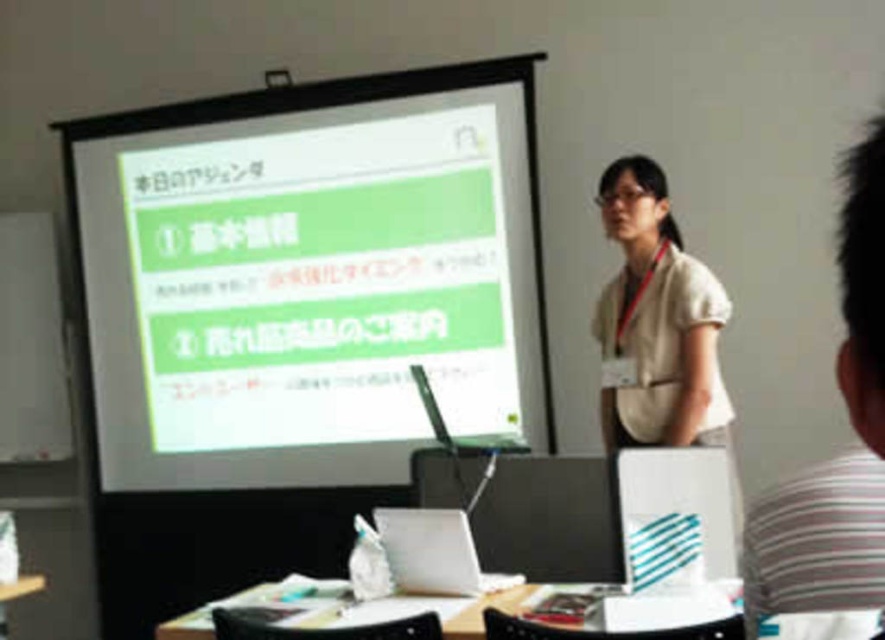
You are a photographer positioned at the front of the room. You want to take a photo that includes both the striped cotton shirt at right and the wooden table at lower center. Which object should you adjust your camera angle to focus on first to ensure both are in frame?

You should focus on the wooden table at lower center first because the striped cotton shirt at right is closer to the viewer, so adjusting for the farther object ensures both will be in frame.